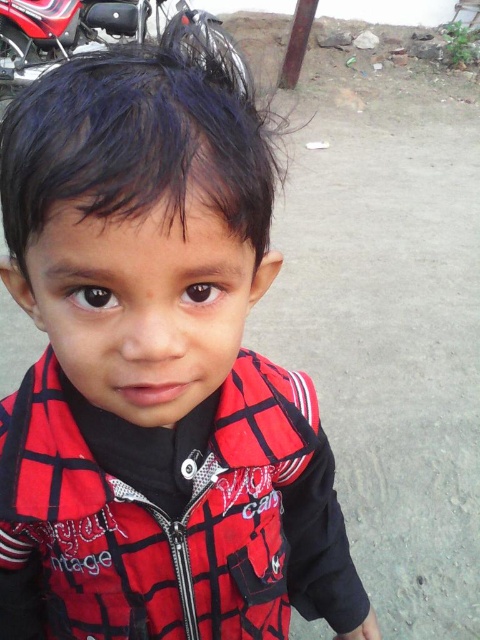
The width and height of the screenshot is (480, 640). Identify the location of red plaid jacket at center. (170, 515).

Is red plaid jacket at center behind shiny metallic motorcycle at upper left?

No, it is in front of shiny metallic motorcycle at upper left.

Locate an element on the screen. The width and height of the screenshot is (480, 640). red plaid jacket at center is located at coordinates (170, 515).